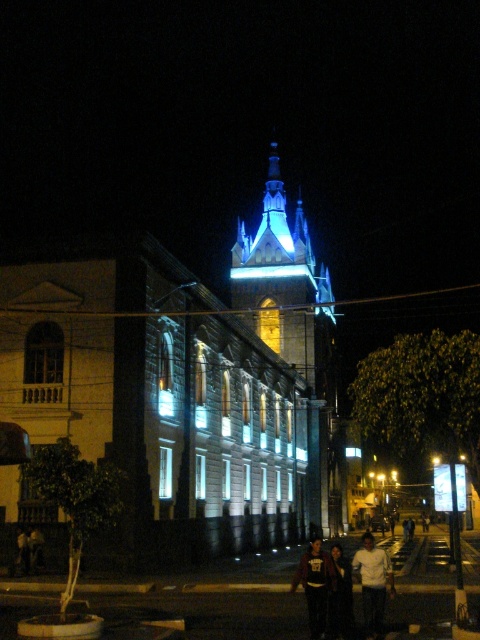
Question: Which point is closer to the camera taking this photo?

Choices:
 (A) (313, 602)
 (B) (367, 628)

Answer: (B)

Question: Is white matte shirt at center positioned at the back of dark blue hoodie at lower center?

Choices:
 (A) yes
 (B) no

Answer: (B)

Question: Which object is closer to the camera taking this photo?

Choices:
 (A) white matte shirt at center
 (B) blue glassy tower at upper center
 (C) dark blue hoodie at lower center

Answer: (A)

Question: Among these objects, which one is nearest to the camera?

Choices:
 (A) blue glassy tower at upper center
 (B) dark blue hoodie at lower center
 (C) white matte shirt at center

Answer: (C)

Question: Does blue glassy tower at upper center have a greater width compared to dark blue hoodie at lower center?

Choices:
 (A) yes
 (B) no

Answer: (A)

Question: Does blue glassy tower at upper center come behind dark blue hoodie at lower center?

Choices:
 (A) yes
 (B) no

Answer: (A)